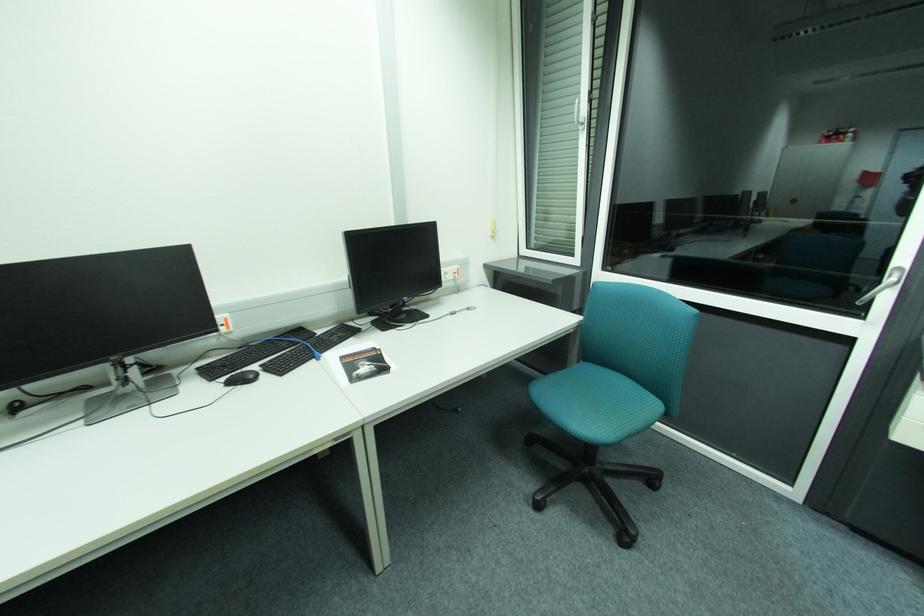
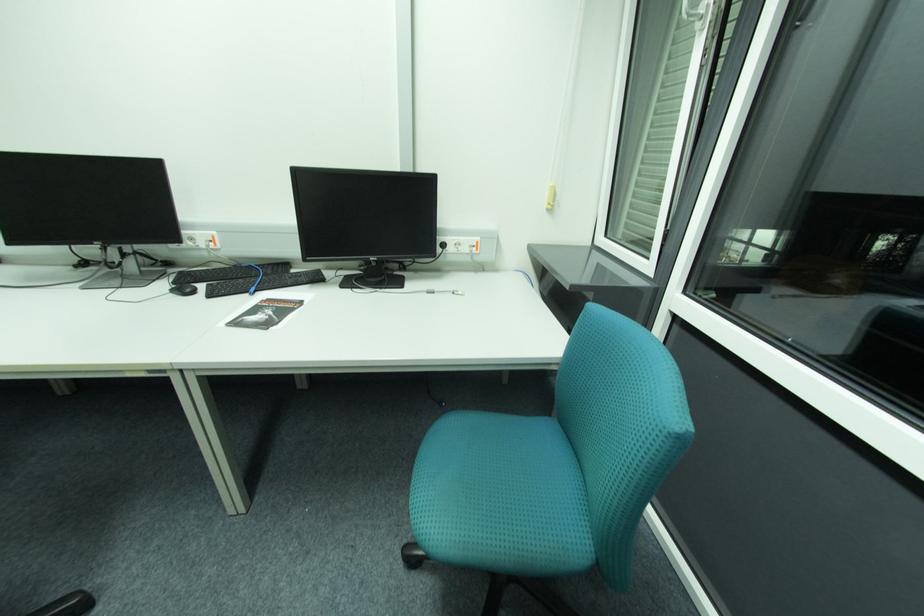
Question: The images are taken continuously from a first-person perspective. In which direction is your viewpoint rotating?

Choices:
 (A) Left
 (B) Right
 (C) Up
 (D) Down

Answer: (A)